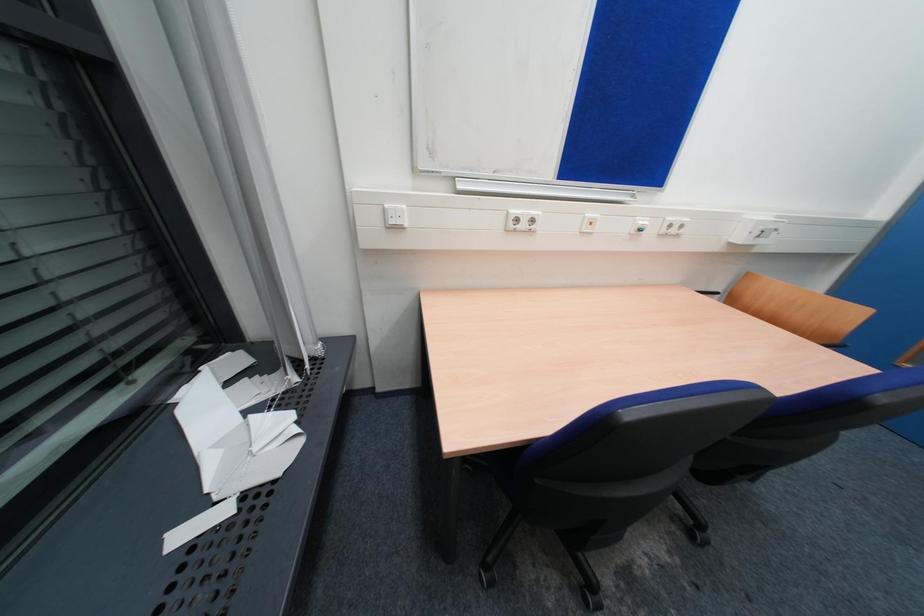
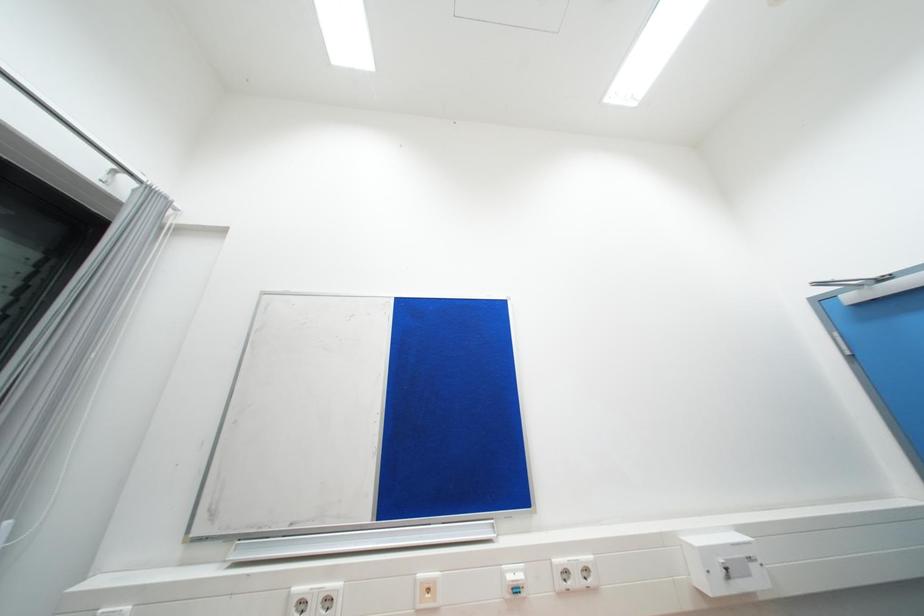
Question: The images are taken continuously from a first-person perspective. In which direction is your viewpoint rotating?

Choices:
 (A) Left
 (B) Right
 (C) Up
 (D) Down

Answer: (C)